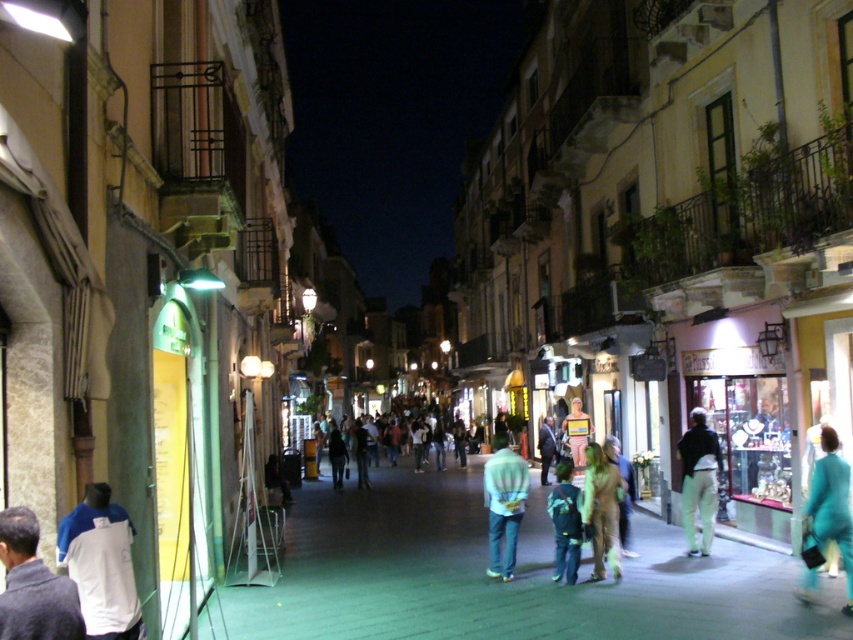
Which is below, green carpet at center or light blue denim jeans at center?

Positioned lower is green carpet at center.

Can you confirm if green carpet at center is thinner than light blue denim jeans at center?

In fact, green carpet at center might be wider than light blue denim jeans at center.

Describe the element at coordinates (500, 580) in the screenshot. I see `green carpet at center` at that location.

The image size is (853, 640). Identify the location of green carpet at center. (500, 580).

Where is `green carpet at center`? Image resolution: width=853 pixels, height=640 pixels. green carpet at center is located at coordinates (500, 580).

Can you confirm if green carpet at center is bigger than white jersey at lower left?

Yes, green carpet at center is bigger than white jersey at lower left.

Who is positioned more to the right, green carpet at center or white jersey at lower left?

green carpet at center is more to the right.

Between point (523, 532) and point (86, 566), which one is positioned in front?

Positioned in front is point (86, 566).

I want to click on green carpet at center, so click(500, 580).